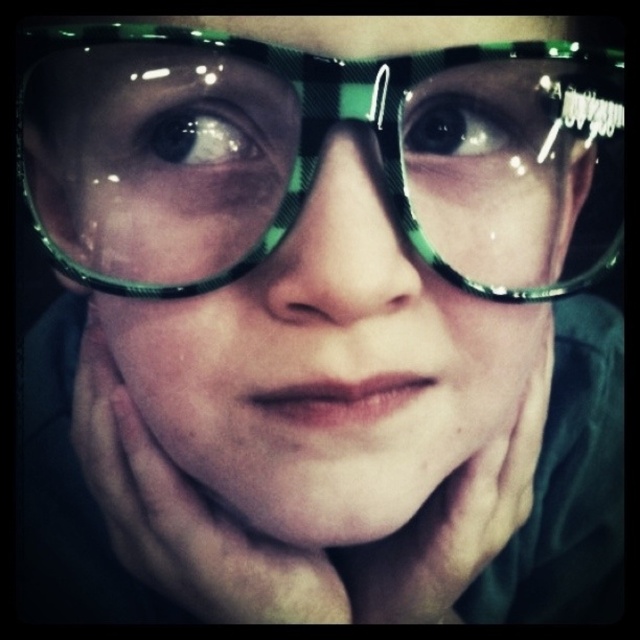
Which of these two, brown glossy eye at upper left or black glossy eye at center, stands shorter?

brown glossy eye at upper left is shorter.

Between point (156, 145) and point (452, 140), which one is positioned behind?

Point (452, 140)

Is point (168, 154) positioned after point (428, 100)?

Yes, it is.

In order to click on brown glossy eye at upper left in this screenshot , I will do `click(198, 136)`.

Does point (140, 189) come behind point (177, 356)?

No, (140, 189) is closer to viewer.

Is green plastic glasses at center shorter than green shiny glasses at center?

Indeed, green plastic glasses at center has a lesser height compared to green shiny glasses at center.

Consider the image. Who is more distant from viewer, (310, 156) or (310, 500)?

The point (310, 500) is more distant.

This screenshot has height=640, width=640. What are the coordinates of `green plastic glasses at center` in the screenshot? It's located at (316, 156).

Is green plastic glasses at center positioned at the back of black glossy eye at center?

No, green plastic glasses at center is closer to the viewer.

Does green plastic glasses at center have a larger size compared to black glossy eye at center?

Yes.

At what (x,y) coordinates should I click in order to perform the action: click on green plastic glasses at center. Please return your answer as a coordinate pair (x, y). Looking at the image, I should click on (316, 156).